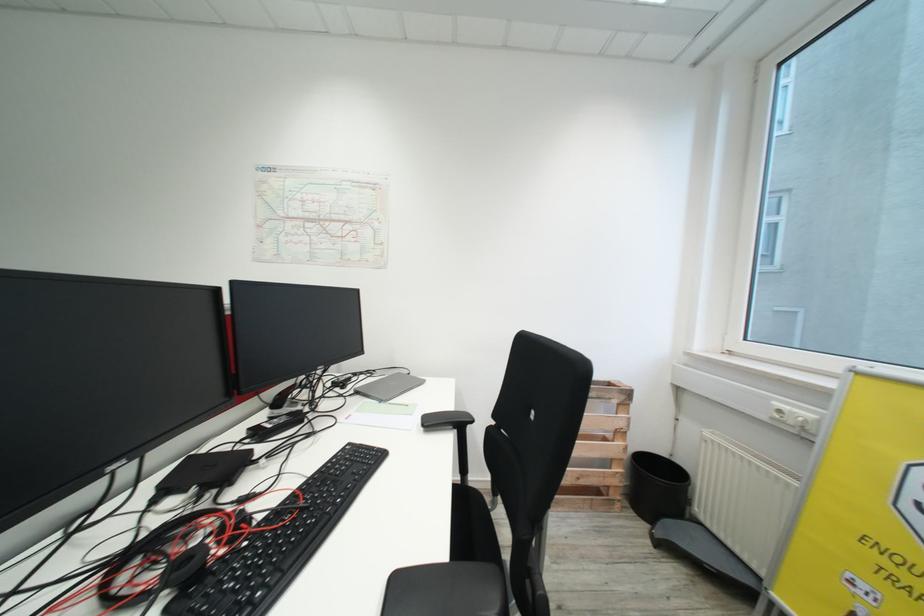
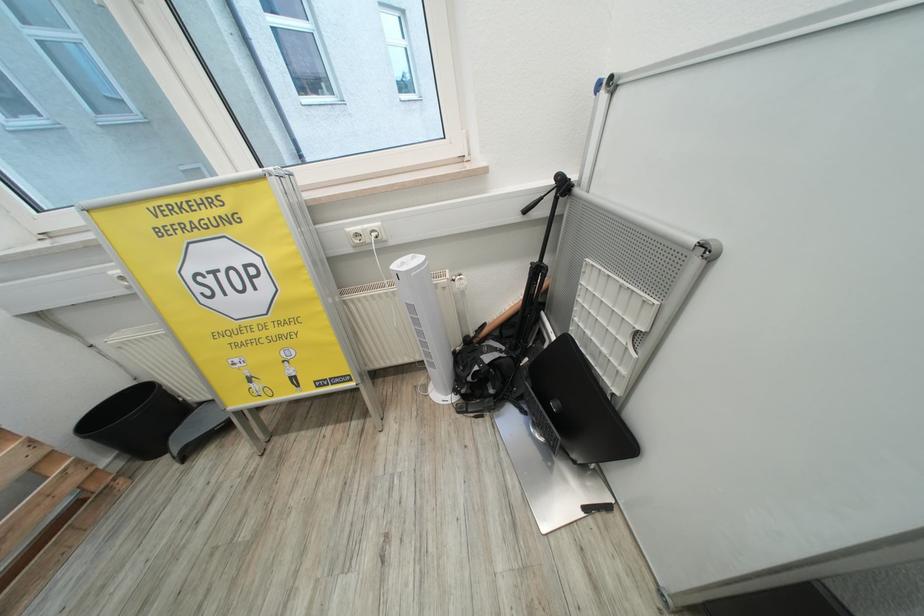
The first image is from the beginning of the video and the second image is from the end. How did the camera likely rotate when shooting the video?

The camera's rotation is toward right-down.